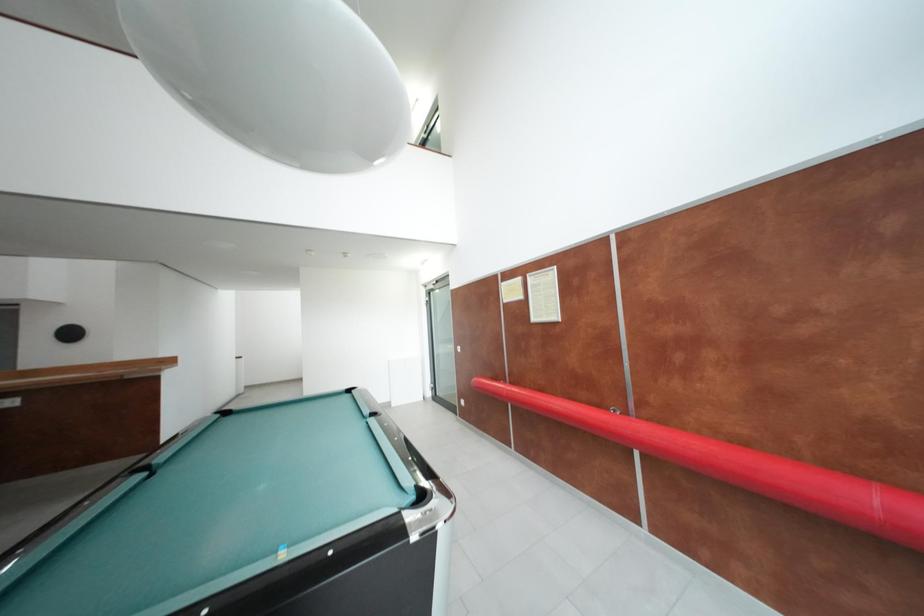
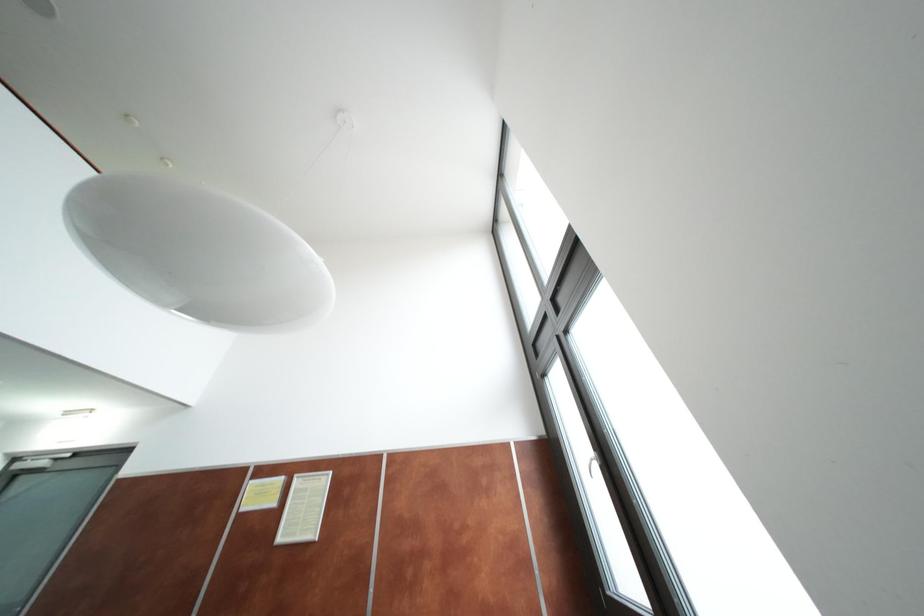
Based on the photo, the first image is from the beginning of the video and the second image is from the end. How did the camera likely rotate when shooting the video?

The rotation direction of the camera is right-up.